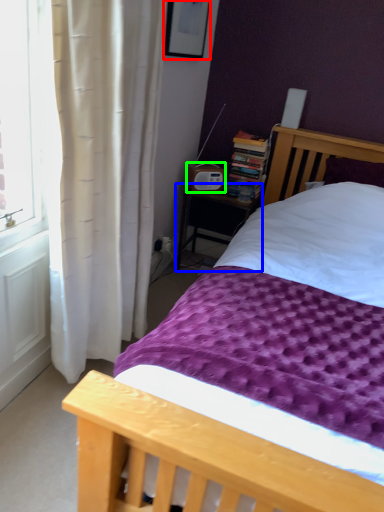
Question: Which object is the farthest from picture frame (highlighted by a red box)? Choose among these: nightstand (highlighted by a blue box) or radio (highlighted by a green box).

Choices:
 (A) nightstand
 (B) radio

Answer: (A)